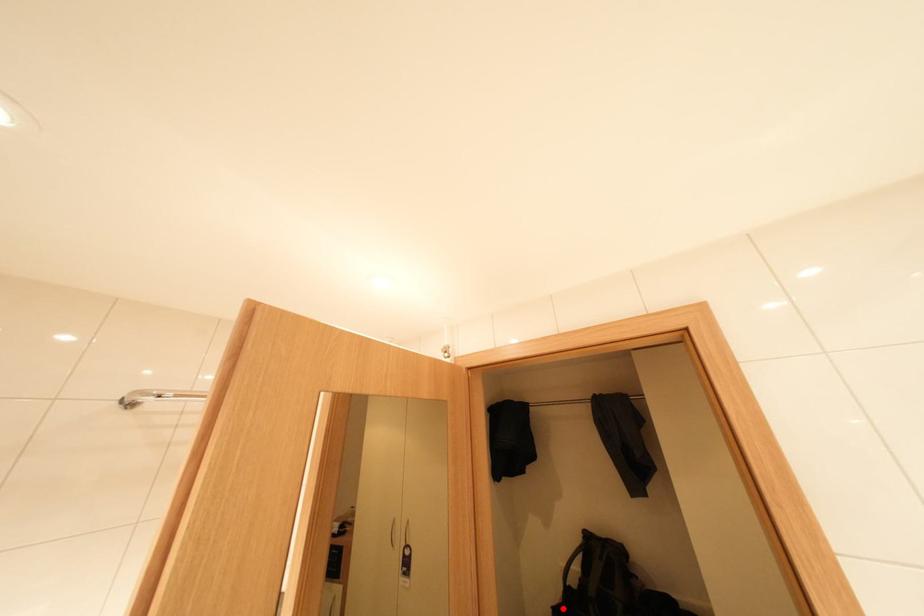
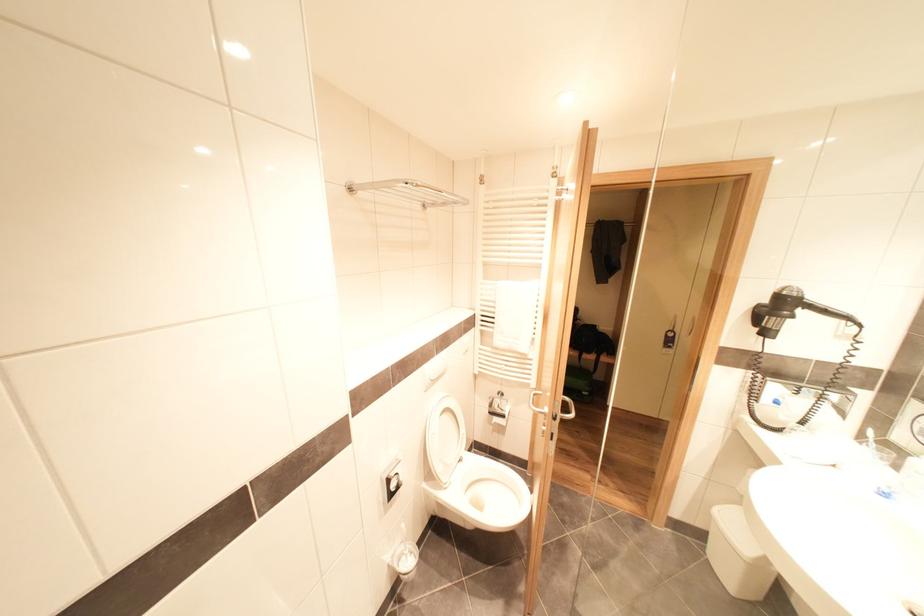
Question: I am providing you with two images of the same scene from different viewpoints. A red point is marked on the first image. Is the red point's position out of view in image 2?

Choices:
 (A) Yes
 (B) No

Answer: (A)